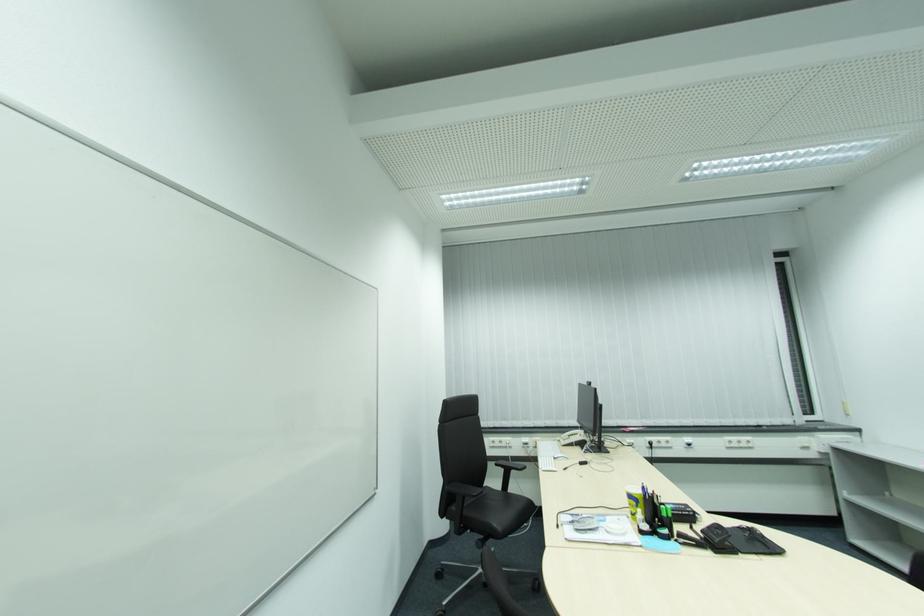
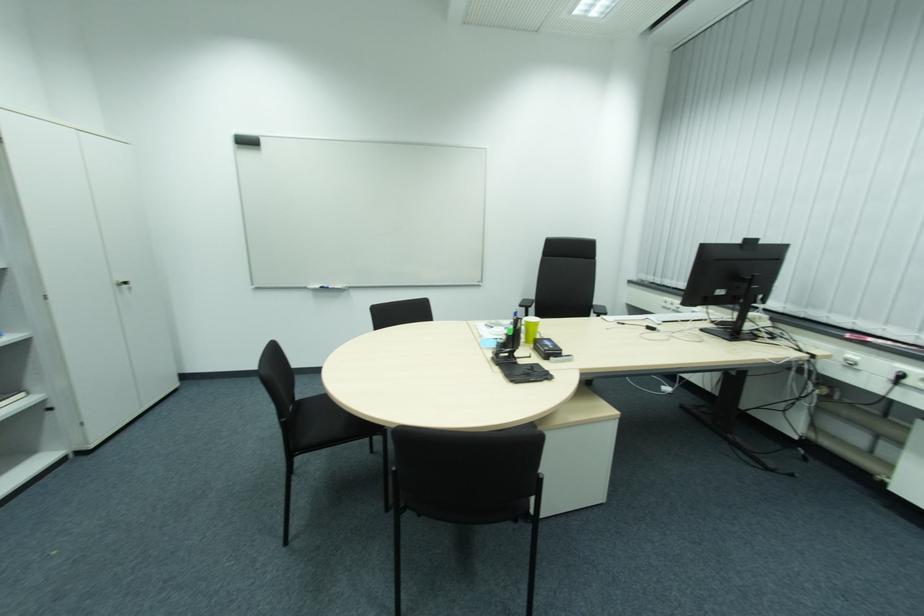
In the second image, find the point that corresponds to (698,514) in the first image.

(550, 351)